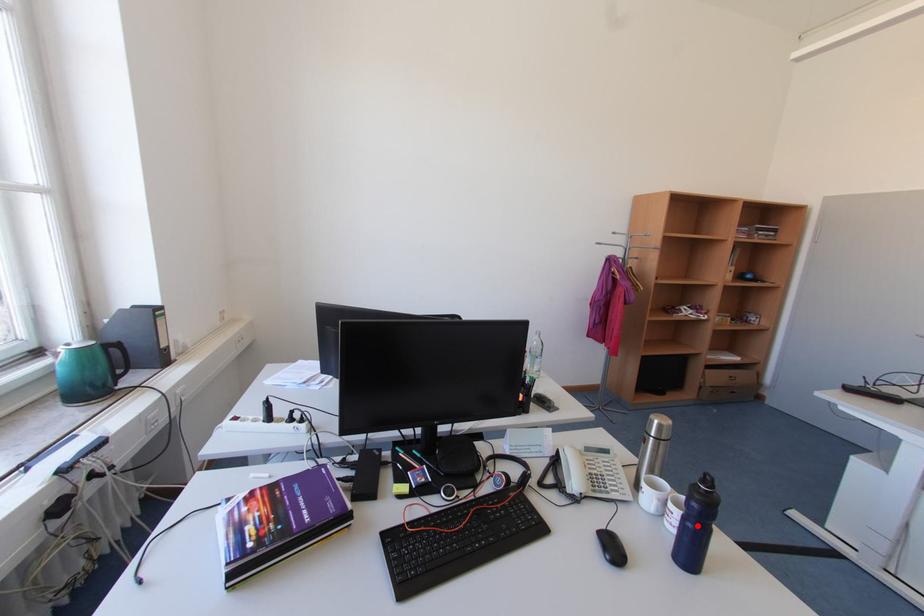
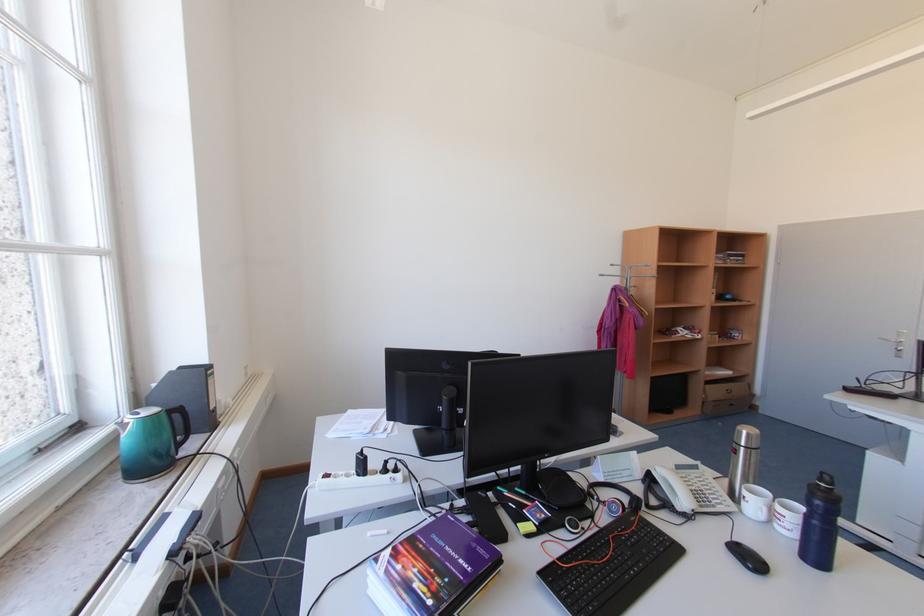
Question: I am providing you with two images of the same scene from different viewpoints. A red point is shown in image1. For the corresponding object point in image2, is it positioned nearer or farther from the camera?

Choices:
 (A) Nearer
 (B) Farther

Answer: (A)